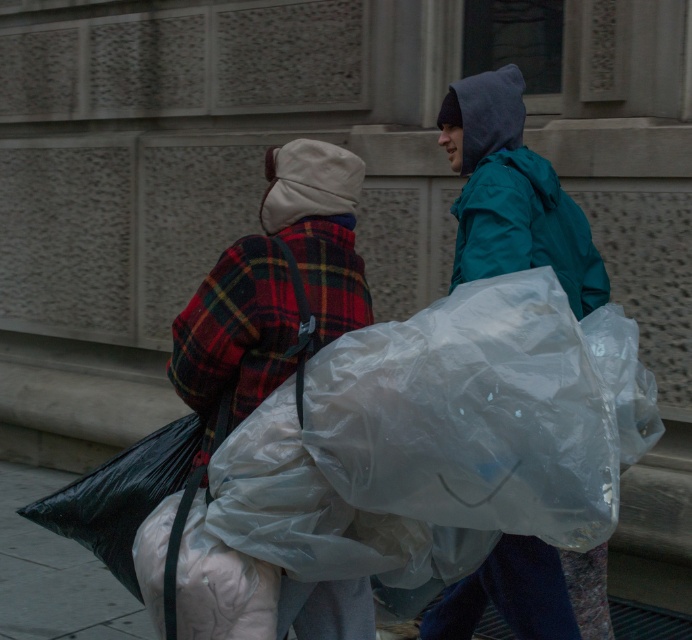
Which is in front, point (331, 148) or point (491, 145)?

Point (331, 148) is more forward.

Based on the photo, does flannel plaid jacket at center have a greater height compared to transparent plastic bag at right?

Yes, flannel plaid jacket at center is taller than transparent plastic bag at right.

Where is `flannel plaid jacket at center`? This screenshot has width=692, height=640. flannel plaid jacket at center is located at coordinates pos(275,285).